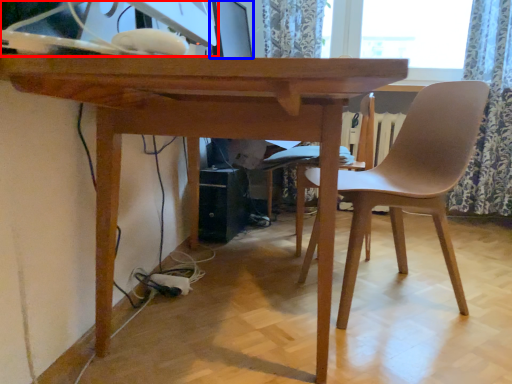
Question: Which object appears farthest to the camera in this image, desktop computer (highlighted by a red box) or computer monitor (highlighted by a blue box)?

Choices:
 (A) desktop computer
 (B) computer monitor

Answer: (B)